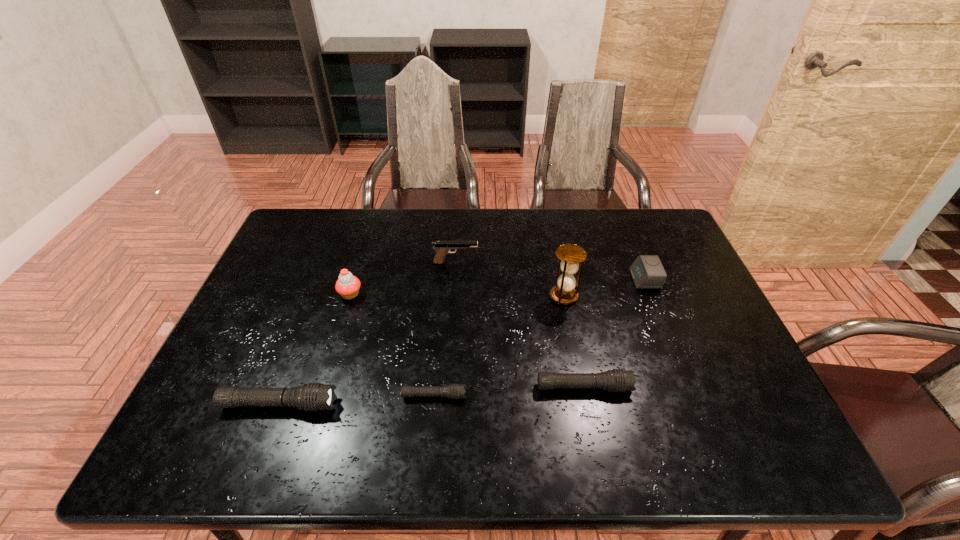
Locate an element on the screen. This screenshot has width=960, height=540. flashlight that stands as the second closest to the hourglass is located at coordinates (454, 391).

Identify which flashlight is the second nearest to the shortest object. Please provide its 2D coordinates. Your answer should be formatted as a tuple, i.e. [(x, y)], where the tuple contains the x and y coordinates of a point satisfying the conditions above.

[(617, 380)]